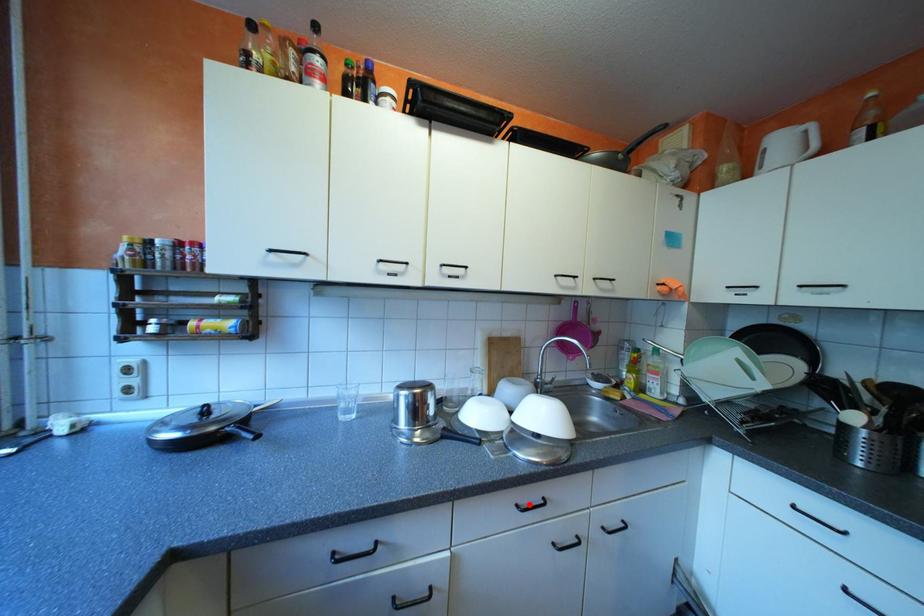
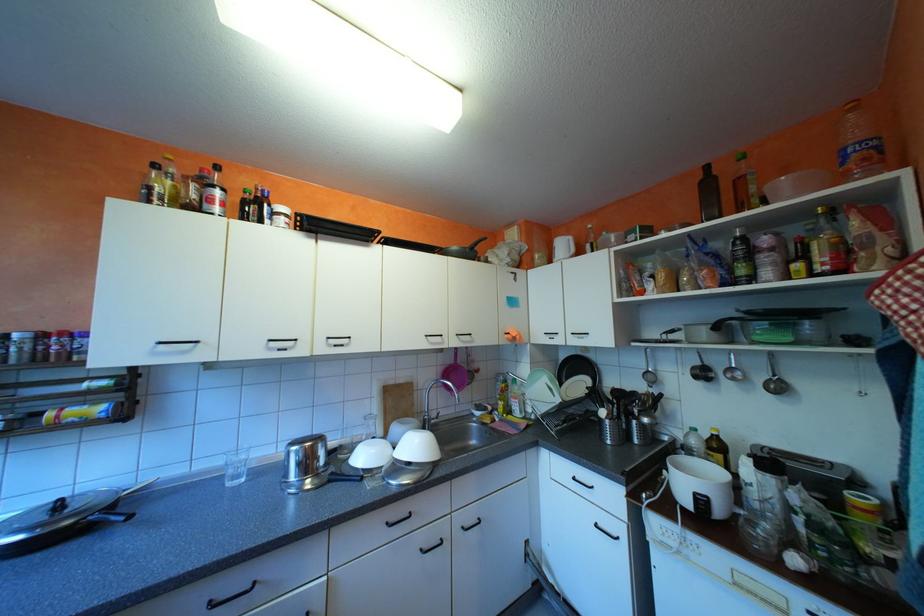
Find the pixel in the second image that matches the highlighted location in the first image.

(398, 523)